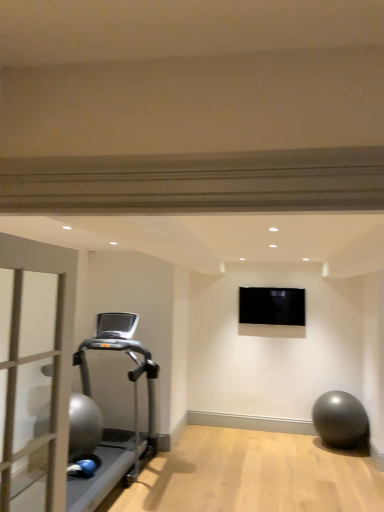
Question: Is matte gray door at left positioned far away from metallic gray ball at lower right?

Choices:
 (A) yes
 (B) no

Answer: (A)

Question: Does matte gray door at left lie behind metallic gray ball at lower right?

Choices:
 (A) yes
 (B) no

Answer: (B)

Question: Can you confirm if matte gray door at left is wider than metallic gray ball at lower right?

Choices:
 (A) yes
 (B) no

Answer: (B)

Question: Is matte gray door at left bigger than metallic gray ball at lower right?

Choices:
 (A) yes
 (B) no

Answer: (B)

Question: Is matte gray door at left to the right of metallic gray ball at lower right from the viewer's perspective?

Choices:
 (A) no
 (B) yes

Answer: (A)

Question: Does matte gray door at left have a lesser width compared to metallic gray ball at lower right?

Choices:
 (A) no
 (B) yes

Answer: (B)

Question: Is matte gray door at left at the left side of black glossy tv at upper center?

Choices:
 (A) no
 (B) yes

Answer: (B)

Question: Does matte gray door at left have a lesser width compared to black glossy tv at upper center?

Choices:
 (A) no
 (B) yes

Answer: (A)

Question: From a real-world perspective, does matte gray door at left sit lower than black glossy tv at upper center?

Choices:
 (A) yes
 (B) no

Answer: (A)

Question: Is matte gray door at left closer to camera compared to black glossy tv at upper center?

Choices:
 (A) yes
 (B) no

Answer: (A)

Question: From a real-world perspective, does matte gray door at left stand above black glossy tv at upper center?

Choices:
 (A) no
 (B) yes

Answer: (A)

Question: Considering the relative positions of matte gray door at left and black glossy tv at upper center in the image provided, is matte gray door at left behind black glossy tv at upper center?

Choices:
 (A) yes
 (B) no

Answer: (B)

Question: Is silver metallic treadmill at left to the left of black glossy tv at upper center from the viewer's perspective?

Choices:
 (A) yes
 (B) no

Answer: (A)